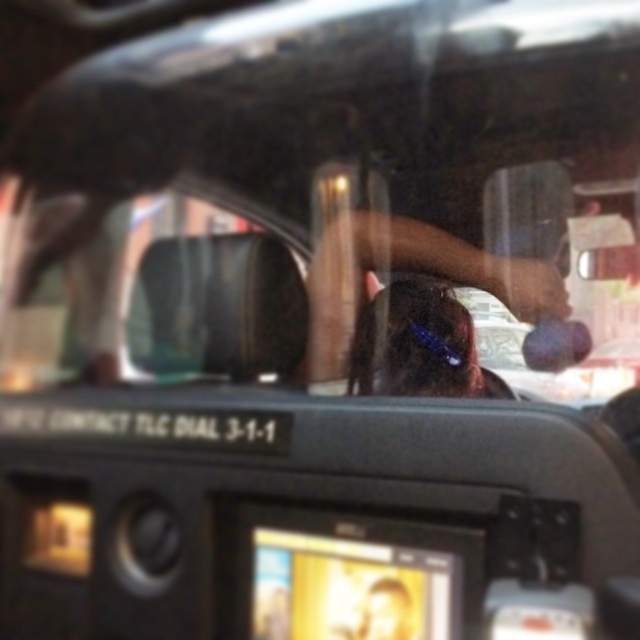
You are a passenger in the vehicle and notice a person in the police car through the windshield. Where exactly is the brown hair at center located in terms of coordinates?

The brown hair at center is located at coordinates point (x=410, y=272).

You are a passenger in the vehicle and notice two people reflected in the windshield. One has brown hair at center and the other has shiny blue hair at center. Which person appears larger in the reflection?

The brown hair at center appears larger in size than the shiny blue hair at center in the reflection.

You are a passenger in the vehicle and want to know which of the two points, point (348, 244) or point (419, 356), is closer to you. Based on the scene description, which point is nearer?

Point (348, 244) is further to the viewer than point (419, 356). Wait, no, the description says the opposite. Let me check again. The Objects Description states that point (348, 244) is further to the viewer than point (419, 356). Therefore, the point closer to you would be point (419, 356) because it is less further away. Hmm, maybe phrasing is tripping me. Let me rephrase. Since point A is further than point B, then B is closer. So the answer is point (419, 356) is closer.